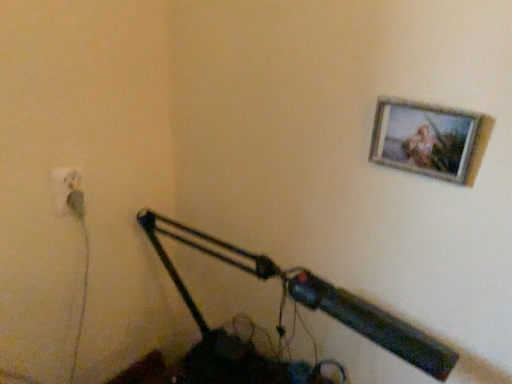
Question: Is wooden frame at upper right to the left or to the right of green rubber plug at lower left in the image?

Choices:
 (A) left
 (B) right

Answer: (B)

Question: Looking at the image, does wooden frame at upper right seem bigger or smaller compared to green rubber plug at lower left?

Choices:
 (A) big
 (B) small

Answer: (A)

Question: Estimate the real-world distances between objects in this image. Which object is farther from the wooden frame at upper right?

Choices:
 (A) metallic black lamp at lower center
 (B) white plastic electric outlet at lower left
 (C) green rubber plug at lower left

Answer: (C)

Question: Estimate the real-world distances between objects in this image. Which object is farther from the metallic black lamp at lower center?

Choices:
 (A) white plastic electric outlet at lower left
 (B) green rubber plug at lower left
 (C) wooden frame at upper right

Answer: (B)